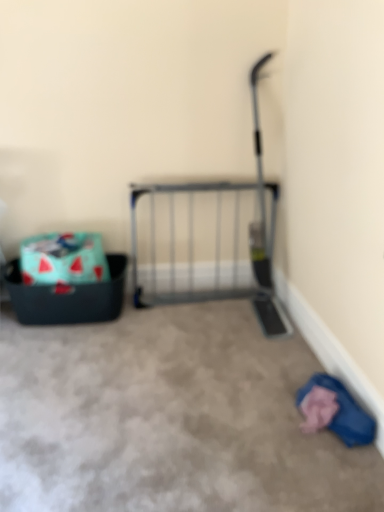
What do you see at coordinates (334, 411) in the screenshot? This screenshot has width=384, height=512. I see `blue fabric at lower right` at bounding box center [334, 411].

This screenshot has height=512, width=384. Describe the element at coordinates (63, 259) in the screenshot. I see `watermelon-patterned fabric storage box at left, the second storage box from the bottom` at that location.

Measure the distance between teal fabric storage box at left, which is the first storage box in bottom-to-top order, and camera.

2.04 meters.

At what (x,y) coordinates should I click in order to perform the action: click on blue fabric at lower right. Please return your answer as a coordinate pair (x, y). The width and height of the screenshot is (384, 512). Looking at the image, I should click on (334, 411).

Is carpet at center with blue fabric at lower right?

They are not placed beside each other.

Can we say carpet at center lies outside blue fabric at lower right?

Yes, carpet at center is located beyond the bounds of blue fabric at lower right.

Considering the sizes of objects carpet at center and blue fabric at lower right in the image provided, who is smaller, carpet at center or blue fabric at lower right?

blue fabric at lower right is smaller.

Which of these two, carpet at center or blue fabric at lower right, is thinner?

With smaller width is blue fabric at lower right.

Can you confirm if teal fabric storage box at left, which is the first storage box in bottom-to-top order, is wider than blue fabric at lower right?

Yes, teal fabric storage box at left, which is the first storage box in bottom-to-top order, is wider than blue fabric at lower right.

Is teal fabric storage box at left, which is the first storage box in bottom-to-top order, looking in the opposite direction of blue fabric at lower right?

No, teal fabric storage box at left, which is the first storage box in bottom-to-top order, is not facing the opposite direction of blue fabric at lower right.

Between teal fabric storage box at left, which is the 2th storage box in top-to-bottom order, and blue fabric at lower right, which one appears on the right side from the viewer's perspective?

blue fabric at lower right.

Between teal fabric storage box at left, which is the first storage box in bottom-to-top order, and blue fabric at lower right, which one has smaller size?

With smaller size is blue fabric at lower right.

From the image's perspective, between metal gate at center and watermelon-patterned fabric storage box at left, acting as the 1th storage box starting from the top, who is located below?

From the image's view, watermelon-patterned fabric storage box at left, acting as the 1th storage box starting from the top, is below.

Looking at this image, is metal gate at center touching watermelon-patterned fabric storage box at left, the second storage box from the bottom?

metal gate at center is not next to watermelon-patterned fabric storage box at left, the second storage box from the bottom, and they're not touching.

Looking at this image, which is behind, metal gate at center or watermelon-patterned fabric storage box at left, acting as the 1th storage box starting from the top?

metal gate at center is further from the camera.

Locate an element on the screen. cage that is above the watermelon-patterned fabric storage box at left, the second storage box from the bottom (from the image's perspective) is located at coordinates (193, 241).

From the image's perspective, which is below, teal fabric storage box at left, which is the first storage box in bottom-to-top order, or watermelon-patterned fabric storage box at left, the second storage box from the bottom?

teal fabric storage box at left, which is the first storage box in bottom-to-top order.

You are a GUI agent. You are given a task and a screenshot of the screen. Output one action in this format:
    pyautogui.click(x=<x>, y=<y>)
    Task: Click on the storage box on the left of teal fabric storage box at left, which is the first storage box in bottom-to-top order
    This screenshot has height=512, width=384.
    Given the screenshot: What is the action you would take?
    pyautogui.click(x=63, y=259)

Between point (84, 311) and point (54, 253), which one is positioned in front?

The point (54, 253) is more forward.

Is teal fabric storage box at left, which is the first storage box in bottom-to-top order, turned away from watermelon-patterned fabric storage box at left, acting as the 1th storage box starting from the top?

No, teal fabric storage box at left, which is the first storage box in bottom-to-top order,'s orientation is not away from watermelon-patterned fabric storage box at left, acting as the 1th storage box starting from the top.

Is point (109, 267) closer to viewer compared to point (210, 406)?

No.

Visually, is teal fabric storage box at left, which is the first storage box in bottom-to-top order, positioned to the left or to the right of carpet at center?

Based on their positions, teal fabric storage box at left, which is the first storage box in bottom-to-top order, is located to the left of carpet at center.

Looking at this image, looking at the image, does teal fabric storage box at left, which is the first storage box in bottom-to-top order, seem bigger or smaller compared to carpet at center?

In the image, teal fabric storage box at left, which is the first storage box in bottom-to-top order, appears to be smaller than carpet at center.

In the scene shown: Is teal fabric storage box at left, which is the 2th storage box in top-to-bottom order, far away from carpet at center?

Answer: No, there isn't a large distance between teal fabric storage box at left, which is the 2th storage box in top-to-bottom order, and carpet at center.

Looking at their sizes, would you say watermelon-patterned fabric storage box at left, the second storage box from the bottom, is wider or thinner than metal gate at center?

watermelon-patterned fabric storage box at left, the second storage box from the bottom, is wider than metal gate at center.

How different are the orientations of watermelon-patterned fabric storage box at left, the second storage box from the bottom, and metal gate at center in degrees?

They differ by 2.21 degrees in their facing directions.

From a real-world perspective, does watermelon-patterned fabric storage box at left, acting as the 1th storage box starting from the top, stand above metal gate at center?

No, from a real-world perspective, watermelon-patterned fabric storage box at left, acting as the 1th storage box starting from the top, is not on top of metal gate at center.

Is watermelon-patterned fabric storage box at left, acting as the 1th storage box starting from the top, oriented towards metal gate at center?

No, watermelon-patterned fabric storage box at left, acting as the 1th storage box starting from the top, is not facing towards metal gate at center.

Does carpet at center have a lesser width compared to teal fabric storage box at left, which is the first storage box in bottom-to-top order?

No.

Where is `concrete in front of the teal fabric storage box at left, which is the first storage box in bottom-to-top order`? concrete in front of the teal fabric storage box at left, which is the first storage box in bottom-to-top order is located at coordinates (168, 418).

Which is nearer, [97,490] or [106,288]?

Point [97,490] is positioned closer to the camera compared to point [106,288].

Are carpet at center and teal fabric storage box at left, which is the 2th storage box in top-to-bottom order, far apart?

No, carpet at center is not far away from teal fabric storage box at left, which is the 2th storage box in top-to-bottom order.

Image resolution: width=384 pixels, height=512 pixels. I want to click on clothing that appears on the right of carpet at center, so click(334, 411).

From the blue fabric at lower right, count 2nd storage boxs backward and point to it. Please provide its 2D coordinates.

[(68, 297)]

Considering their positions, is carpet at center positioned closer to metal gate at center than teal fabric storage box at left, which is the 2th storage box in top-to-bottom order?

Among the two, teal fabric storage box at left, which is the 2th storage box in top-to-bottom order, is located nearer to metal gate at center.

Considering their positions, is teal fabric storage box at left, which is the 2th storage box in top-to-bottom order, positioned closer to metal gate at center than watermelon-patterned fabric storage box at left, the second storage box from the bottom?

Based on the image, teal fabric storage box at left, which is the 2th storage box in top-to-bottom order, appears to be nearer to metal gate at center.

From the image, which object appears to be farther from teal fabric storage box at left, which is the first storage box in bottom-to-top order, blue fabric at lower right or carpet at center?

Based on the image, blue fabric at lower right appears to be further to teal fabric storage box at left, which is the first storage box in bottom-to-top order.

Which object lies further to the anchor point blue fabric at lower right, teal fabric storage box at left, which is the 2th storage box in top-to-bottom order, or metal gate at center?

The object further to blue fabric at lower right is teal fabric storage box at left, which is the 2th storage box in top-to-bottom order.

When comparing their distances from carpet at center, does metal gate at center or watermelon-patterned fabric storage box at left, the second storage box from the bottom, seem closer?

The object closer to carpet at center is watermelon-patterned fabric storage box at left, the second storage box from the bottom.

Which object lies further to the anchor point carpet at center, teal fabric storage box at left, which is the 2th storage box in top-to-bottom order, or watermelon-patterned fabric storage box at left, acting as the 1th storage box starting from the top?

Based on the image, watermelon-patterned fabric storage box at left, acting as the 1th storage box starting from the top, appears to be further to carpet at center.

When comparing their distances from carpet at center, does blue fabric at lower right or teal fabric storage box at left, which is the first storage box in bottom-to-top order, seem further?

Based on the image, teal fabric storage box at left, which is the first storage box in bottom-to-top order, appears to be further to carpet at center.

Based on their spatial positions, is carpet at center or teal fabric storage box at left, which is the 2th storage box in top-to-bottom order, further from watermelon-patterned fabric storage box at left, acting as the 1th storage box starting from the top?

The object further to watermelon-patterned fabric storage box at left, acting as the 1th storage box starting from the top, is carpet at center.

Image resolution: width=384 pixels, height=512 pixels. What are the coordinates of `storage box located between carpet at center and teal fabric storage box at left, which is the 2th storage box in top-to-bottom order, in the depth direction` in the screenshot? It's located at (63, 259).

The width and height of the screenshot is (384, 512). Identify the location of storage box between watermelon-patterned fabric storage box at left, acting as the 1th storage box starting from the top, and blue fabric at lower right, in the horizontal direction. pos(68,297).

Locate an element on the screen. storage box between watermelon-patterned fabric storage box at left, acting as the 1th storage box starting from the top, and metal gate at center from left to right is located at coordinates (68, 297).

I want to click on concrete between teal fabric storage box at left, which is the 2th storage box in top-to-bottom order, and blue fabric at lower right from left to right, so click(x=168, y=418).